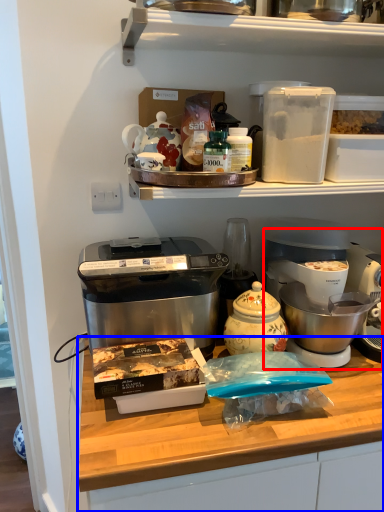
Question: Among these objects, which one is nearest to the camera, coffee maker (highlighted by a red box) or table (highlighted by a blue box)?

Choices:
 (A) coffee maker
 (B) table

Answer: (B)